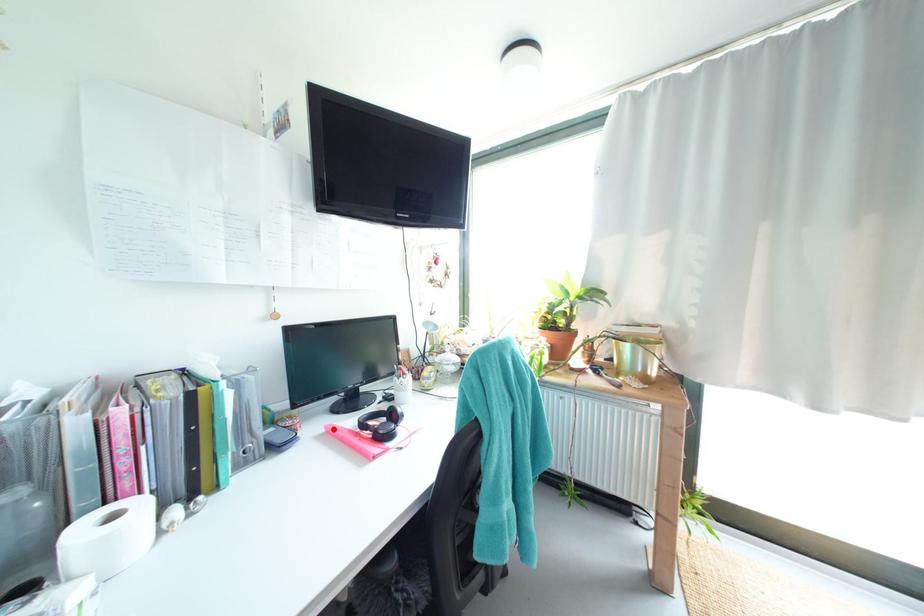
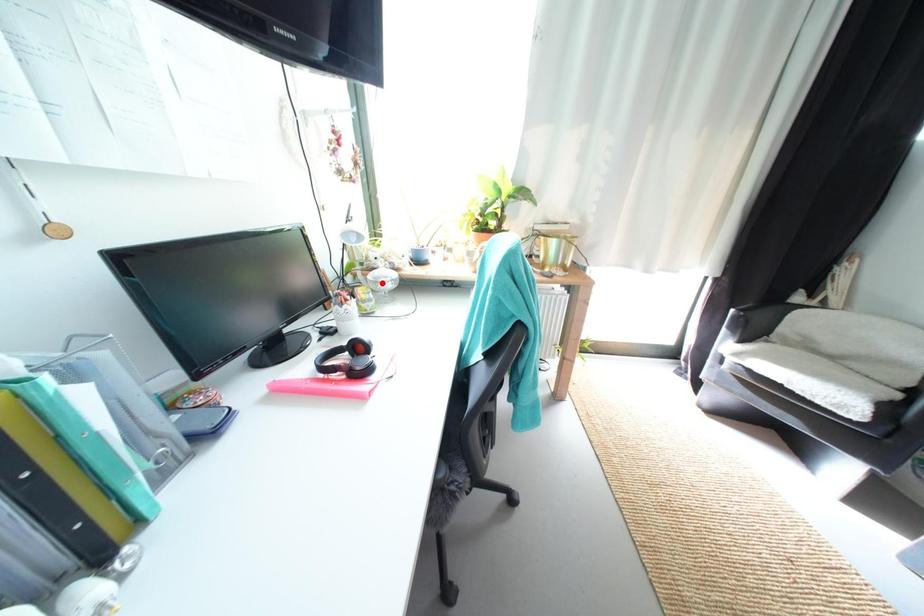
From the picture: I am providing you with two images of the same scene from different viewpoints. A red point is marked on the first image and another point is marked on the second image. Is the red point in image1 aligned with the point shown in image2?

No